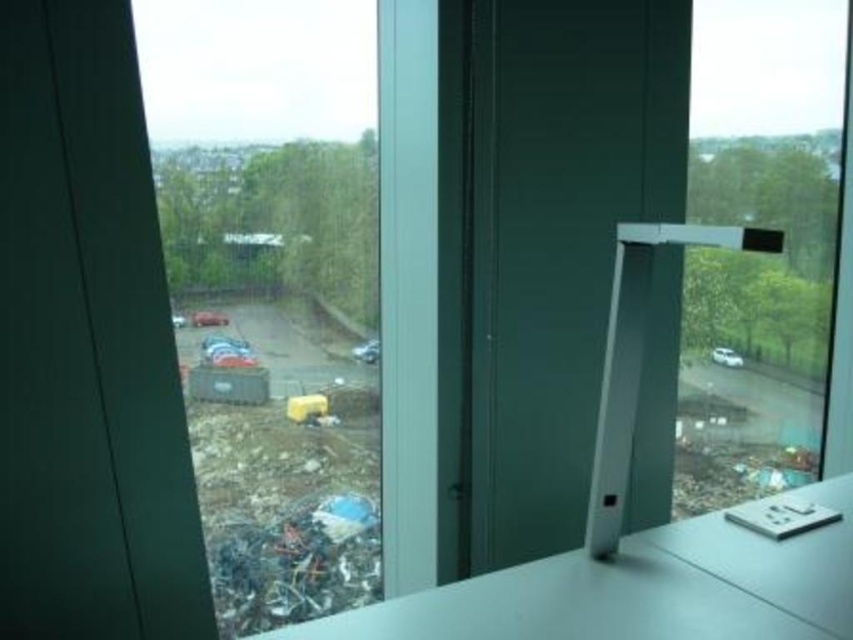
Question: Can you confirm if transparent glass window at right is positioned above white glossy table at lower right?

Choices:
 (A) no
 (B) yes

Answer: (B)

Question: Which point is closer to the camera?

Choices:
 (A) white glossy table at lower right
 (B) transparent glass window at right

Answer: (A)

Question: Which of the following is the farthest from the observer?

Choices:
 (A) transparent glass window at center
 (B) white glossy table at lower right
 (C) transparent glass window at right

Answer: (C)

Question: Can you confirm if transparent glass window at right is smaller than white glossy counter top at center?

Choices:
 (A) no
 (B) yes

Answer: (A)

Question: Is transparent glass window at right positioned in front of white glossy counter top at center?

Choices:
 (A) no
 (B) yes

Answer: (A)

Question: Which object is positioned closest to the white glossy table at lower right?

Choices:
 (A) transparent glass window at center
 (B) transparent glass window at right
 (C) white glossy counter top at center

Answer: (C)